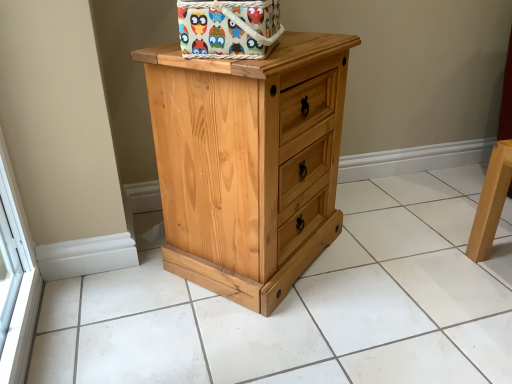
Identify the location of unoccupied region to the right of natural wood chest of drawers at center. (392, 257).